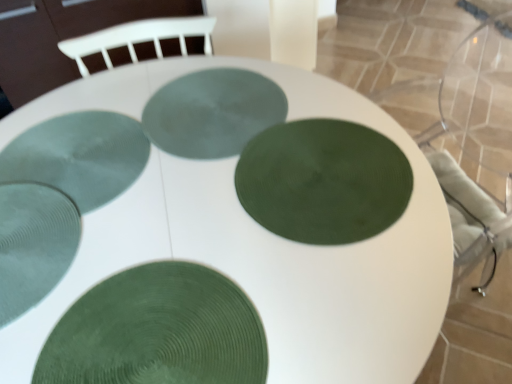
Find the location of a particular element. This screenshot has width=512, height=384. free spot behind green textured glass plate at center, which ranks as the third glass plate in front-to-back order is located at coordinates (265, 94).